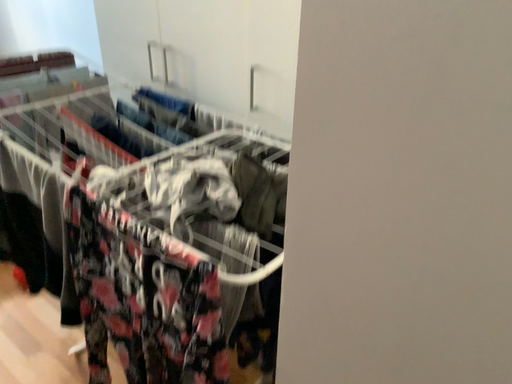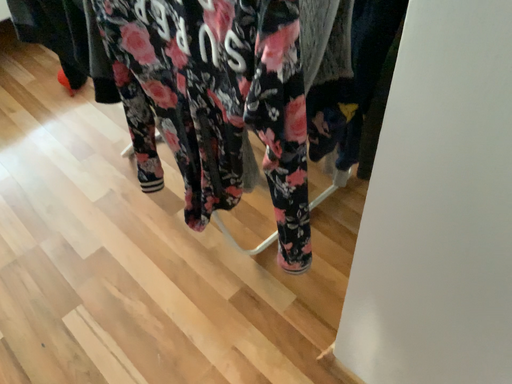
Question: How did the camera likely rotate when shooting the video?

Choices:
 (A) rotated upward
 (B) rotated downward

Answer: (B)